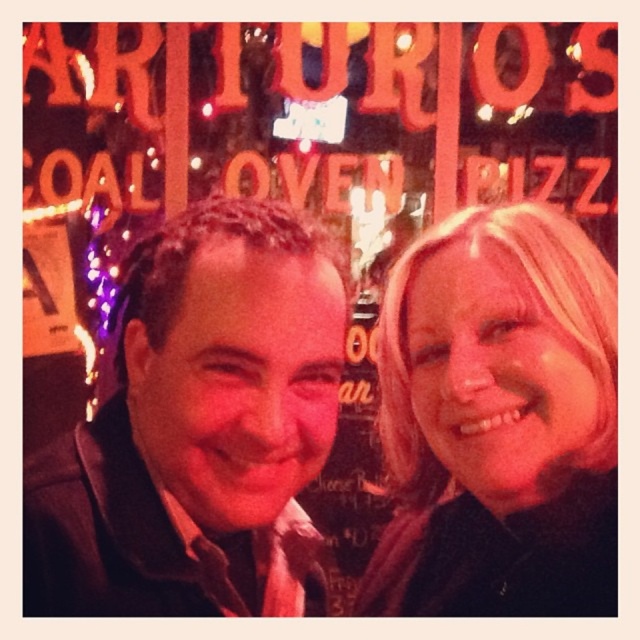
Question: Does matte black jacket at center have a smaller size compared to blonde hair at upper right?

Choices:
 (A) yes
 (B) no

Answer: (A)

Question: Which object is farther from the camera taking this photo?

Choices:
 (A) blonde hair at upper right
 (B) matte black jacket at center

Answer: (A)

Question: Can you confirm if matte black jacket at center is positioned below blonde hair at upper right?

Choices:
 (A) no
 (B) yes

Answer: (A)

Question: Which point is closer to the camera?

Choices:
 (A) (305, 384)
 (B) (570, 380)

Answer: (B)

Question: Which object is closer to the camera taking this photo?

Choices:
 (A) blonde hair at upper right
 (B) matte black jacket at center

Answer: (B)

Question: Does matte black jacket at center have a greater width compared to blonde hair at upper right?

Choices:
 (A) no
 (B) yes

Answer: (B)